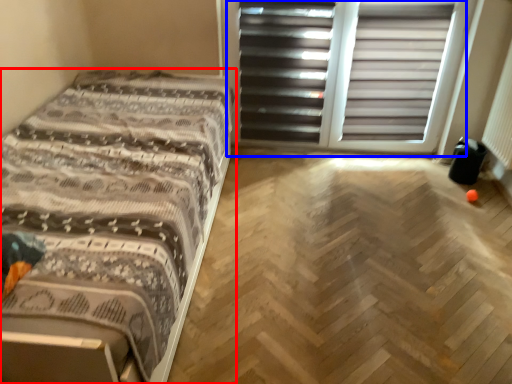
Question: Which object is further to the camera taking this photo, bed (highlighted by a red box) or screen door (highlighted by a blue box)?

Choices:
 (A) bed
 (B) screen door

Answer: (B)